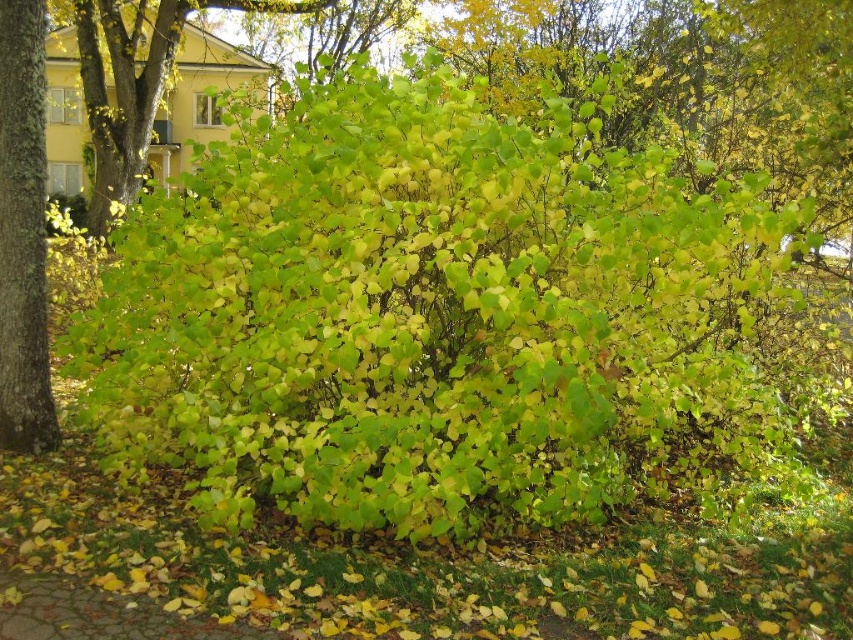
You are standing in the autumn scene and want to walk from the green rough bark tree at left to the cobblestone path at lower left. Which direction should you move to reach the path?

You should move away from the green rough bark tree at left towards the cobblestone path at lower left because the tree is closer to you than the path, so moving forward would take you towards the path.